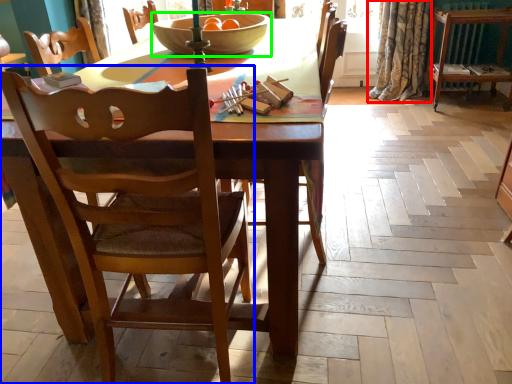
Question: Which is nearer to the curtain (highlighted by a red box)? chair (highlighted by a blue box) or bowl (highlighted by a green box).

Choices:
 (A) chair
 (B) bowl

Answer: (B)